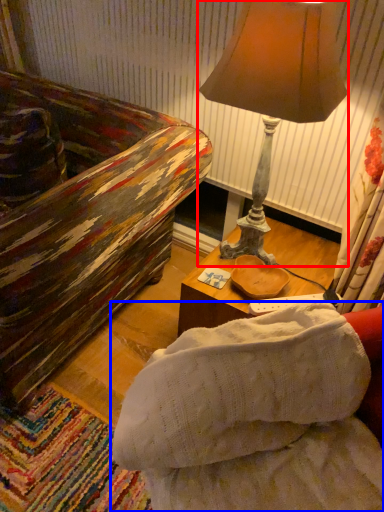
Question: Which object is further to the camera taking this photo, lamp (highlighted by a red box) or studio couch (highlighted by a blue box)?

Choices:
 (A) lamp
 (B) studio couch

Answer: (A)